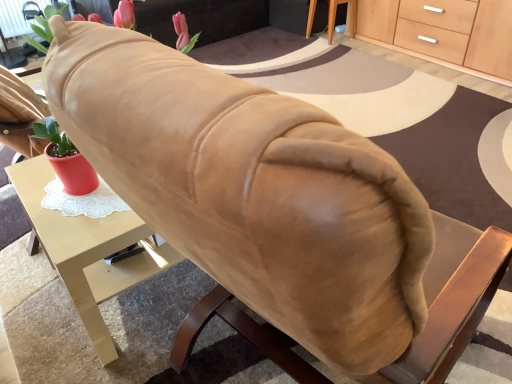
Locate an element on the screen. This screenshot has height=384, width=512. blank space above matte gold desk at center (from a real-world perspective) is located at coordinates (68, 195).